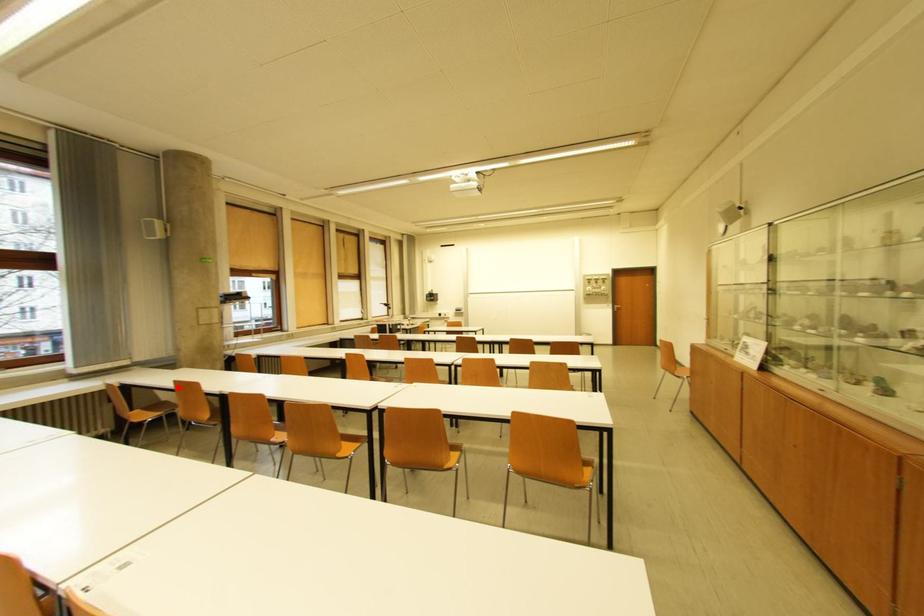
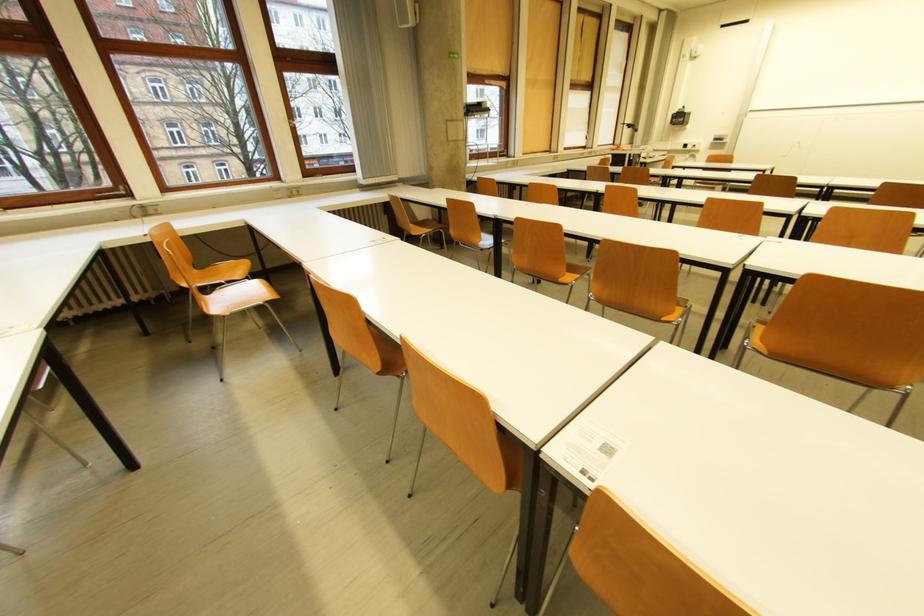
Locate, in the second image, the point that corresponds to the highlighted location in the first image.

(451, 206)